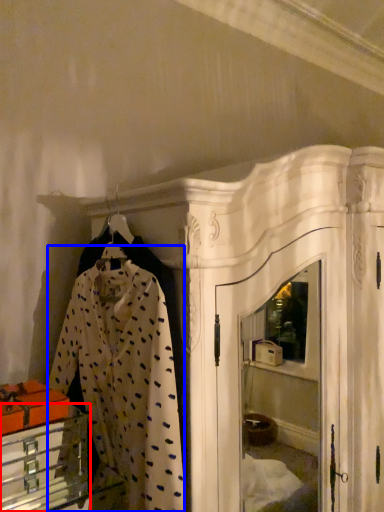
Question: Which object appears farthest to the camera in this image, furniture (highlighted by a red box) or clothing (highlighted by a blue box)?

Choices:
 (A) furniture
 (B) clothing

Answer: (A)